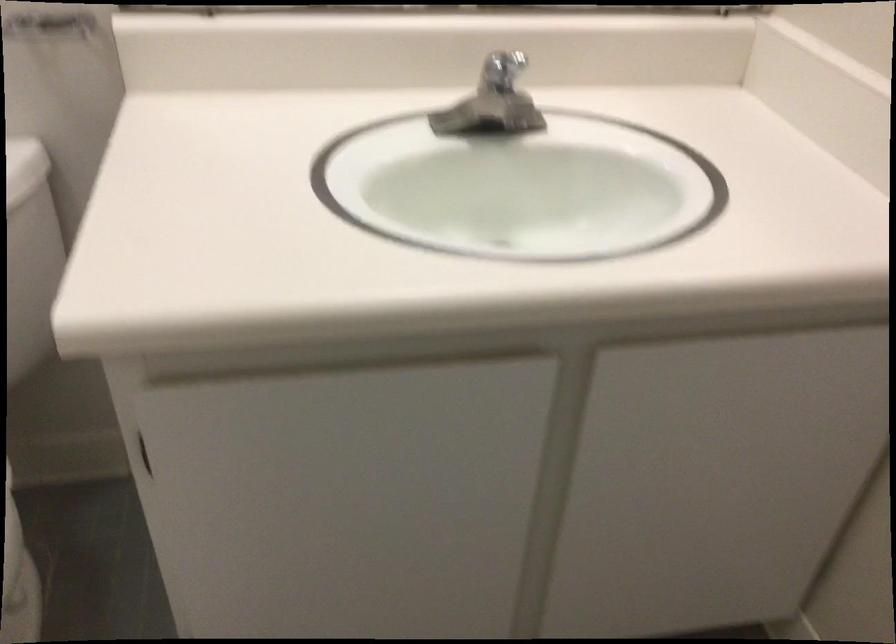
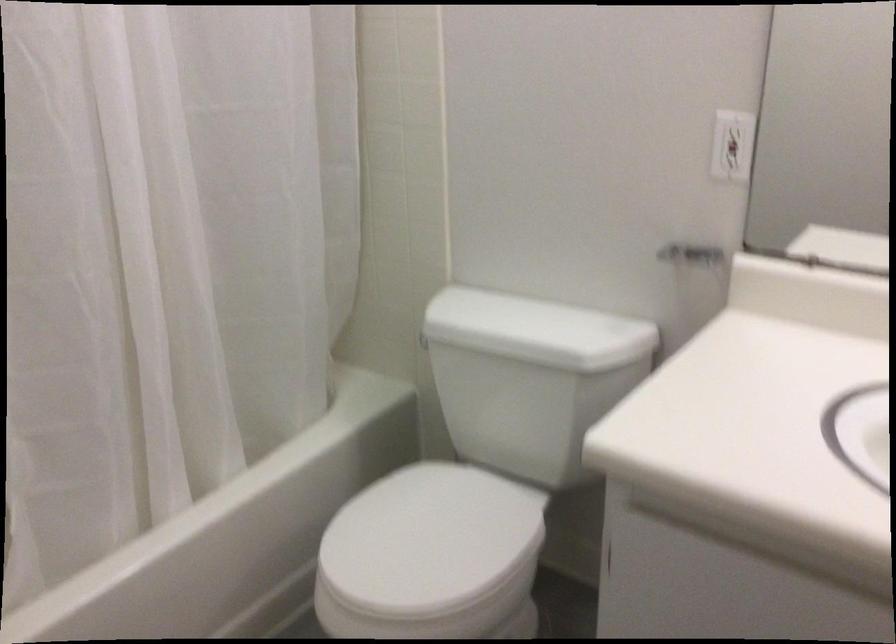
Question: How did the camera likely rotate?

Choices:
 (A) Left
 (B) Right
 (C) Up
 (D) Down

Answer: (A)